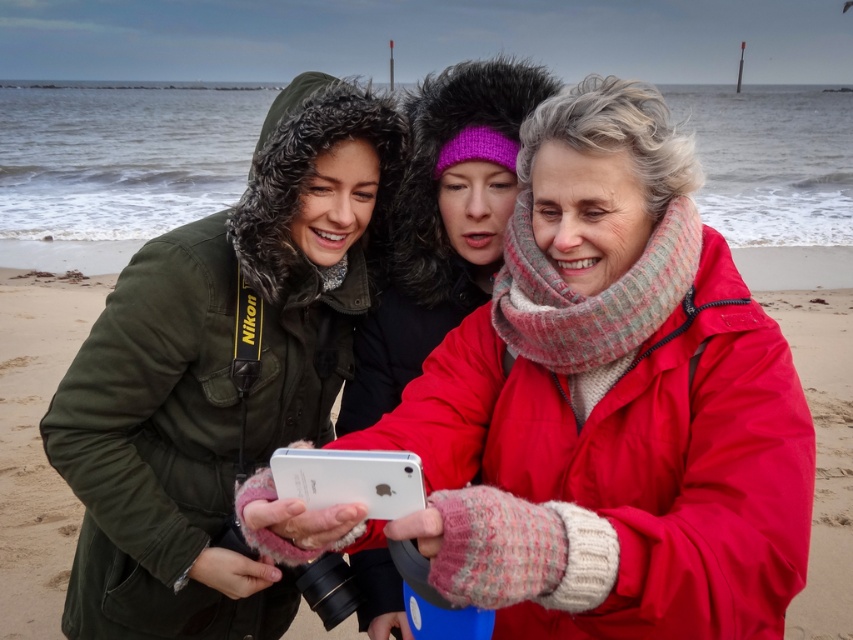
You are trying to take a group selfie with three friends on a beach. You notice a knitted pink scarf at center and a white matte smartphone at center. Based on their sizes, can the smartphone fit entirely within the area occupied by the scarf?

The knitted pink scarf at center might be wider than white matte smartphone at center, so there is a possibility that the smartphone can fit within the scarf area, but it depends on their exact dimensions.